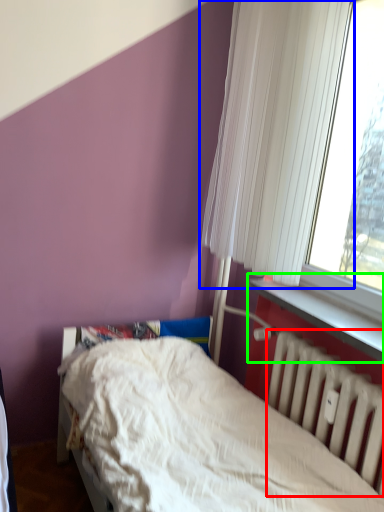
Question: Which object is positioned farthest from radiator (highlighted by a red box)? Select from curtain (highlighted by a blue box) and window sill (highlighted by a green box).

Choices:
 (A) curtain
 (B) window sill

Answer: (A)